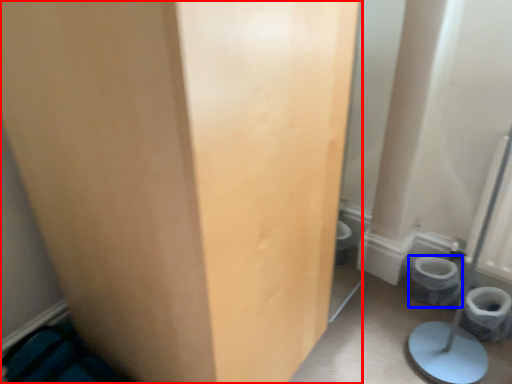
Question: Among these objects, which one is nearest to the camera, door (highlighted by a red box) or toilet bowl (highlighted by a blue box)?

Choices:
 (A) door
 (B) toilet bowl

Answer: (A)